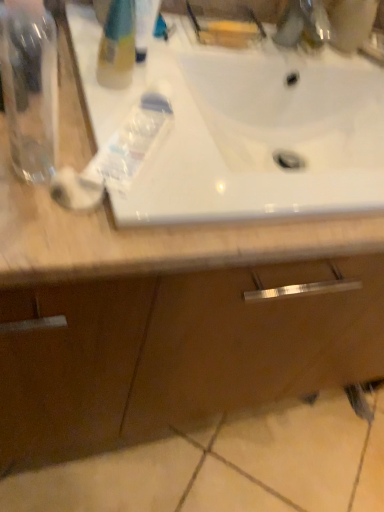
The height and width of the screenshot is (512, 384). In order to click on vacant area that is situated to the right of transparent plastic bottle at left in this screenshot , I will do `click(173, 231)`.